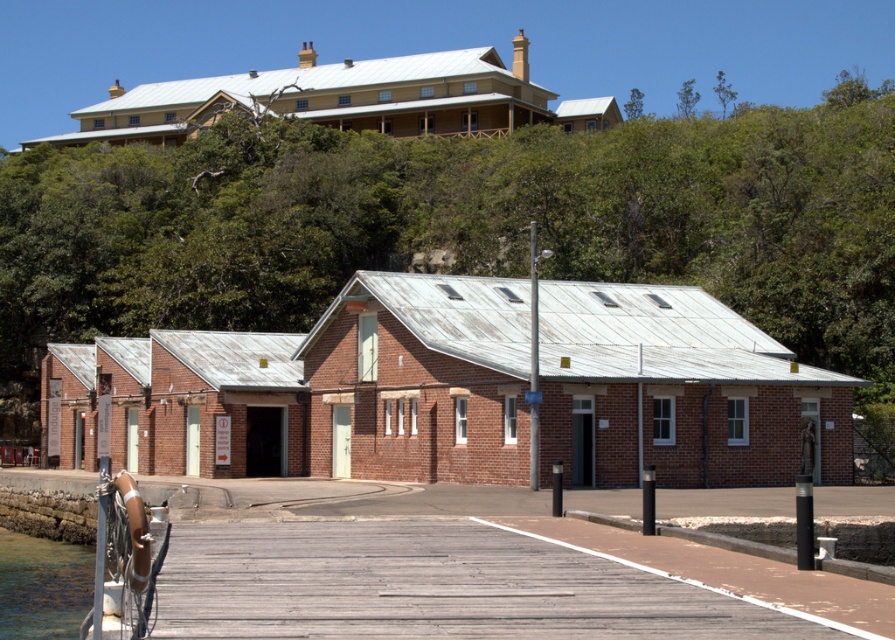
Does wooden planks at center have a larger size compared to clear water at dock lower left?

Incorrect, wooden planks at center is not larger than clear water at dock lower left.

Is point (594, 572) positioned in front of point (64, 611)?

Yes, point (594, 572) is closer to viewer.

Image resolution: width=895 pixels, height=640 pixels. In order to click on wooden planks at center in this screenshot , I will do `click(482, 582)`.